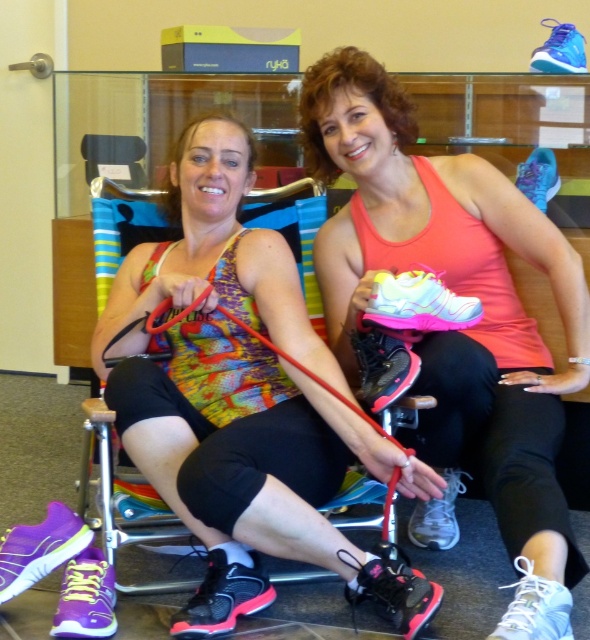
Is multicolored fabric tank top at center smaller than rubber/elastic leash at center?

No.

Which is below, multicolored fabric tank top at center or rubber/elastic leash at center?

rubber/elastic leash at center

Does point (379, 445) come farther from viewer compared to point (224, 310)?

No, (379, 445) is closer to viewer.

Locate an element on the screen. This screenshot has height=640, width=590. multicolored fabric tank top at center is located at coordinates coord(242,400).

Does point (428, 376) lie behind point (253, 332)?

Yes, point (428, 376) is farther from viewer.

Which is more to the left, pink matte shoe at center or rubber/elastic leash at center?

rubber/elastic leash at center is more to the left.

Does point (566, 544) come farther from viewer compared to point (326, 381)?

No.

Where is `pink matte shoe at center`? Image resolution: width=590 pixels, height=640 pixels. pink matte shoe at center is located at coordinates (460, 330).

Can you confirm if multicolored fabric tank top at center is shorter than pink matte shoe at center?

Yes, multicolored fabric tank top at center is shorter than pink matte shoe at center.

What are the coordinates of `multicolored fabric tank top at center` in the screenshot? It's located at (242, 400).